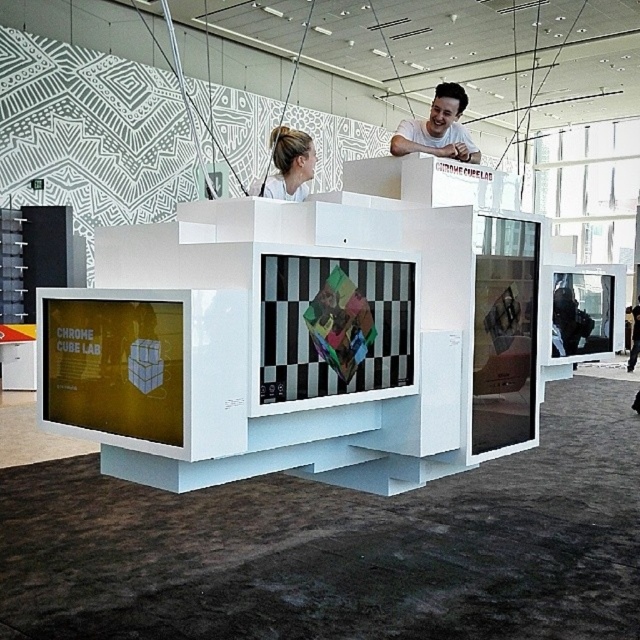
Between matte white shirt at upper center and white matte hair at upper center, which one is positioned higher?

matte white shirt at upper center is higher up.

Which is below, matte white shirt at upper center or white matte hair at upper center?

white matte hair at upper center is lower down.

Does point (401, 125) come farther from viewer compared to point (260, 186)?

Yes, point (401, 125) is farther from viewer.

I want to click on matte white shirt at upper center, so point(436,129).